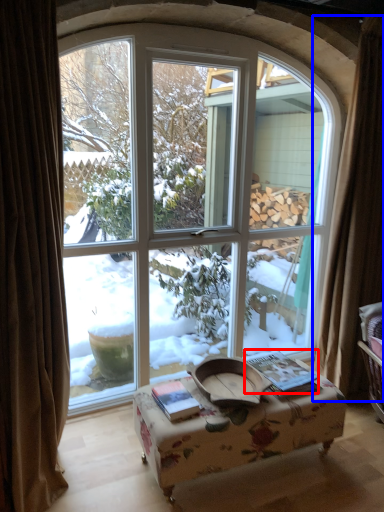
Question: Which object is closer to the camera taking this photo, book (highlighted by a red box) or curtain (highlighted by a blue box)?

Choices:
 (A) book
 (B) curtain

Answer: (A)